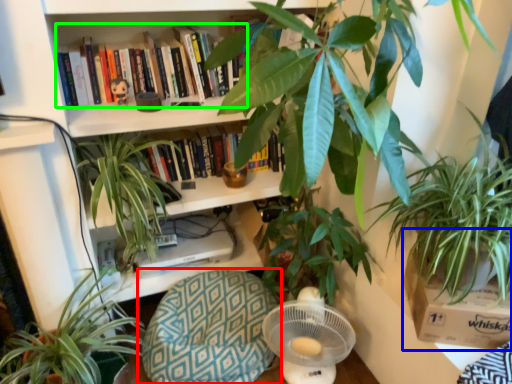
Question: Which is farther away from swivel chair (highlighted by a red box)? cardboard box (highlighted by a blue box) or book (highlighted by a green box)?

Choices:
 (A) cardboard box
 (B) book

Answer: (B)